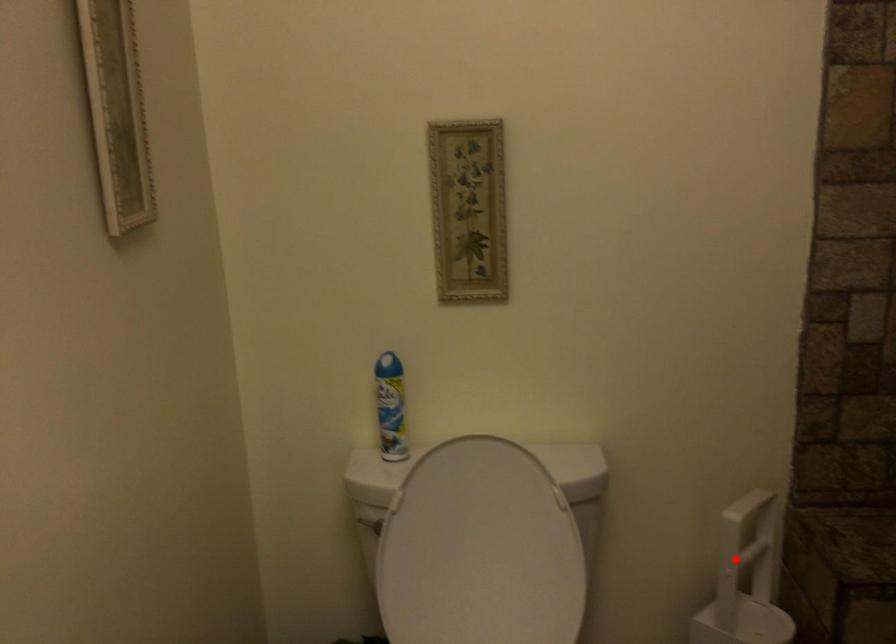
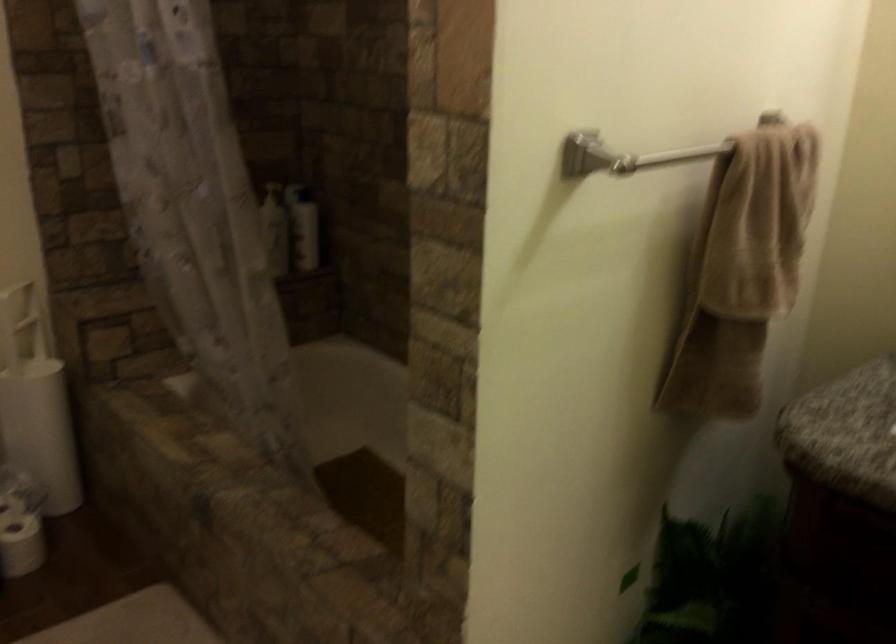
Question: I am providing you with two images of the same scene from different viewpoints. A red point is marked on the first image. Can you still see the location of the red point in image 2?

Choices:
 (A) Yes
 (B) No

Answer: (A)